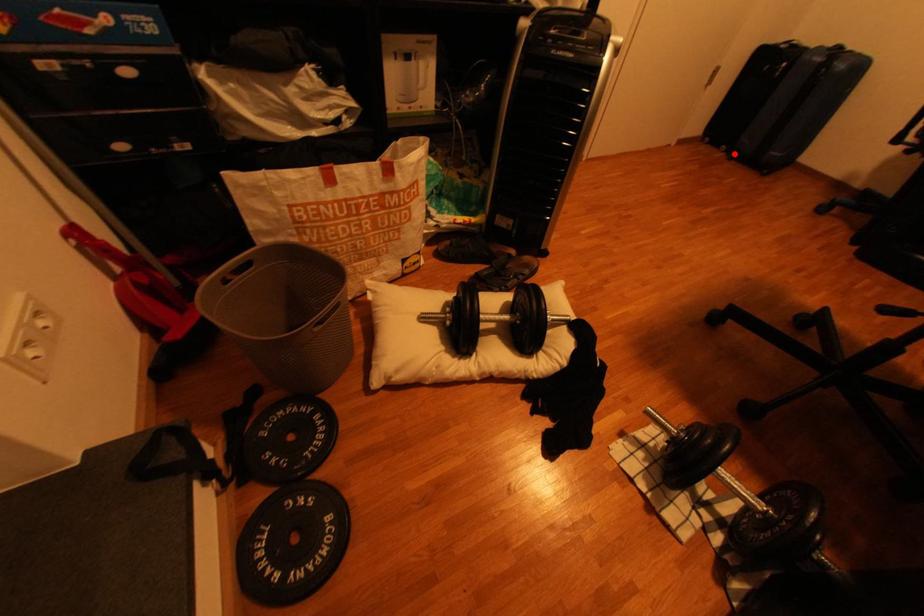
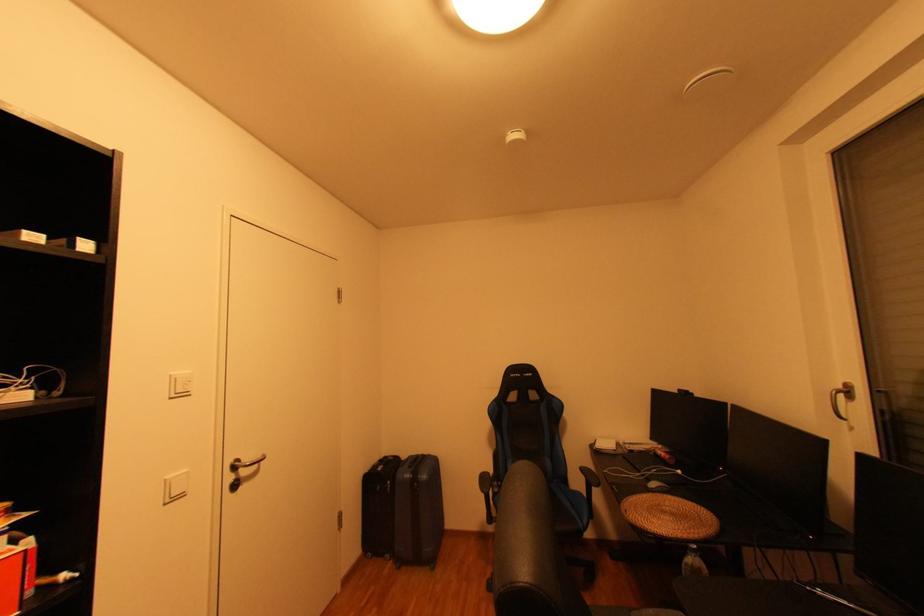
In the second image, find the point that corresponds to the highlighted location in the first image.

(400, 562)